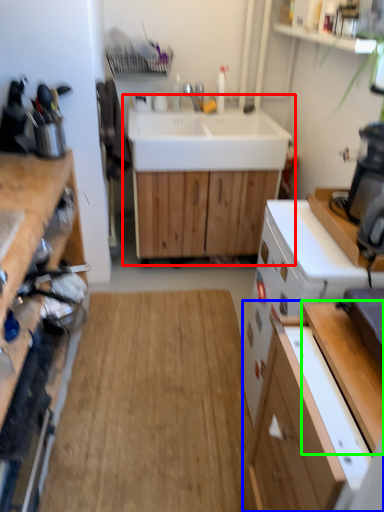
Question: Which object is the closest to the sink (highlighted by a red box)? Choose among these: cabinetry (highlighted by a blue box) or table (highlighted by a green box).

Choices:
 (A) cabinetry
 (B) table

Answer: (B)